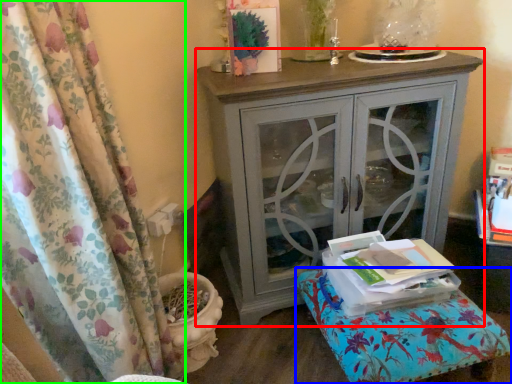
Question: Which is nearer to the nightstand (highlighted by a red box)? furniture (highlighted by a blue box) or curtain (highlighted by a green box).

Choices:
 (A) furniture
 (B) curtain

Answer: (A)